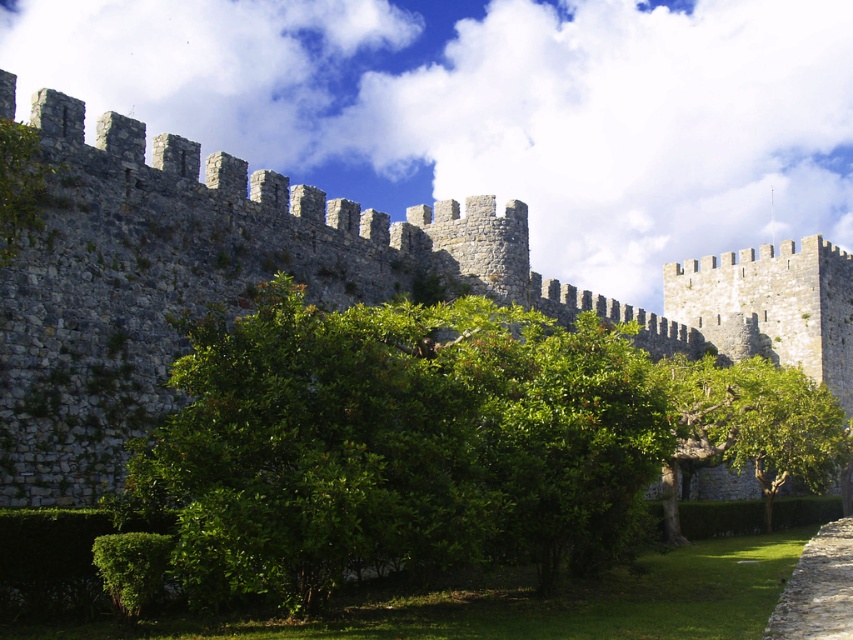
Question: Which point is closer to the camera?

Choices:
 (A) gray stone wall at lower right
 (B) green leafy bush at center

Answer: (B)

Question: Is green leafy bush at center thinner than gray stone wall at lower right?

Choices:
 (A) yes
 (B) no

Answer: (B)

Question: Which object is positioned farthest from the gray stone wall at lower right?

Choices:
 (A) green leafy bush at center
 (B) gray stone wall at center

Answer: (B)

Question: Does gray stone wall at center appear under gray stone wall at lower right?

Choices:
 (A) yes
 (B) no

Answer: (B)

Question: Which point is closer to the camera?

Choices:
 (A) (96, 266)
 (B) (819, 627)
 (C) (138, 604)

Answer: (C)

Question: In this image, where is green leafy bush at center located relative to gray stone wall at lower right?

Choices:
 (A) below
 (B) above

Answer: (B)